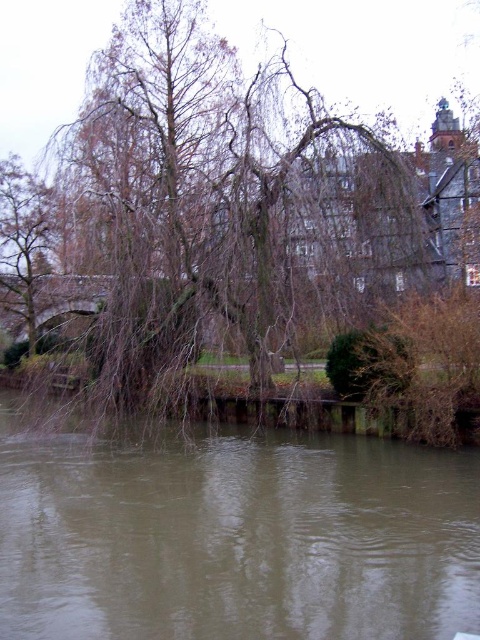
Question: From the image, what is the correct spatial relationship of brown textured tree at upper left in relation to brown textured tree at left?

Choices:
 (A) right
 (B) left

Answer: (A)

Question: Can you confirm if brown textured tree at upper left is positioned to the left of brown textured tree at left?

Choices:
 (A) yes
 (B) no

Answer: (B)

Question: Estimate the real-world distances between objects in this image. Which object is closer to the brown textured tree at left?

Choices:
 (A) brown textured tree at upper left
 (B) brown murky water at lower center

Answer: (A)

Question: Which of the following is the closest to the observer?

Choices:
 (A) brown textured tree at upper left
 (B) brown murky water at lower center
 (C) brown textured tree at left

Answer: (B)

Question: Can you confirm if brown textured tree at upper left is positioned to the right of brown murky water at lower center?

Choices:
 (A) no
 (B) yes

Answer: (B)

Question: Estimate the real-world distances between objects in this image. Which object is closer to the brown textured tree at upper left?

Choices:
 (A) brown textured tree at left
 (B) brown murky water at lower center

Answer: (B)